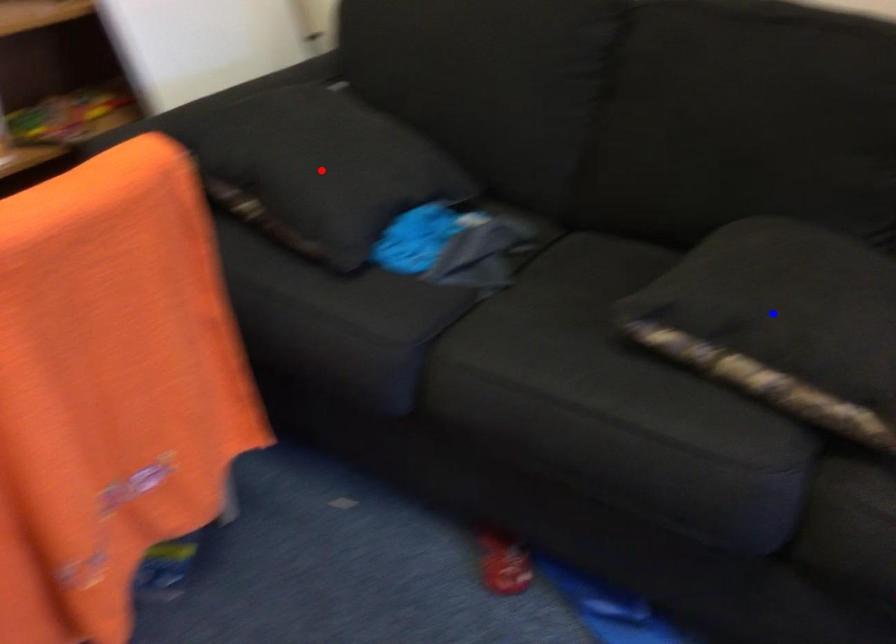
Question: Which of the two points in the image is closer to the camera?

Choices:
 (A) Blue point is closer.
 (B) Red point is closer.

Answer: (A)